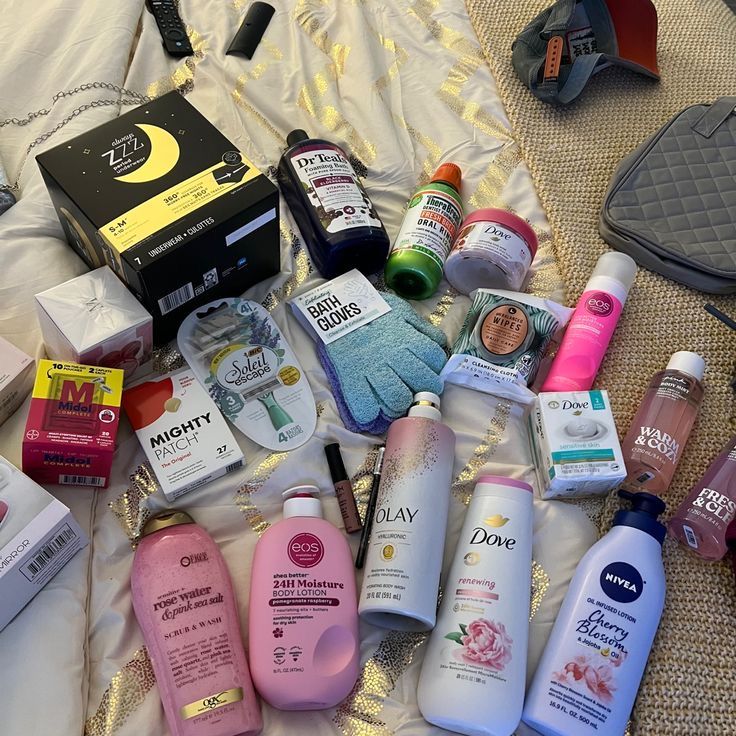
Where is `box`? box is located at coordinates (42, 536), (15, 366), (93, 305), (184, 439), (176, 204), (84, 399), (587, 435).